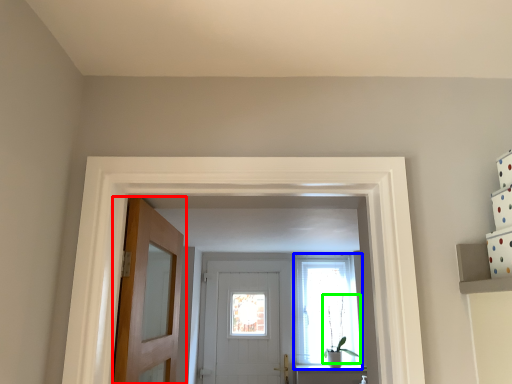
Question: Estimate the real-world distances between objects in this image. Which object is farther from door (highlighted by a red box), window (highlighted by a blue box) or plant (highlighted by a green box)?

Choices:
 (A) window
 (B) plant

Answer: (B)